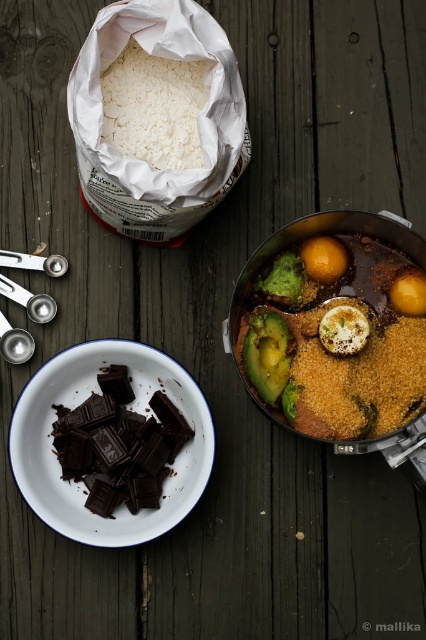
You are a chef preparing a recipe that requires precise measurements. You have two items on your counter, the dark chocolate chunks at bottom left and the glossy yellow egg at center right. Which item should you measure first if you need to use the larger one first?

The dark chocolate chunks at bottom left is bigger than the glossy yellow egg at center right, so you should measure the dark chocolate chunks at bottom left first.

You are a chef trying to retrieve the glossy yellow egg at center right using the brushed metal spoon at lower left. Can you reach the egg with the spoon without moving either object?

The glossy yellow egg at center right is located above the brushed metal spoon at lower left, so yes, the spoon can reach the egg since it is positioned below it.

You are a chef preparing a dish and need to locate the white powdery rice at upper left and the green matte broccoli at center. Which of these two items is placed higher in the image?

The white powdery rice at upper left is positioned over the green matte broccoli at center, so it is higher in the image.